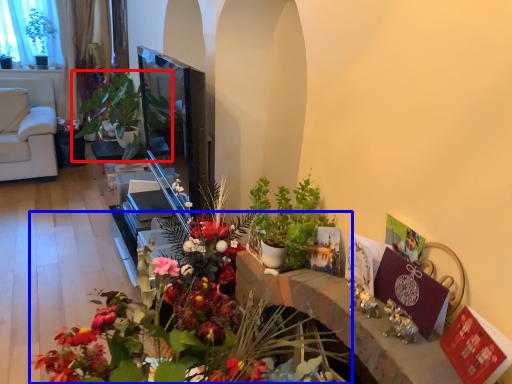
Question: Among these objects, which one is nearest to the camera, houseplant (highlighted by a red box) or flower (highlighted by a blue box)?

Choices:
 (A) houseplant
 (B) flower

Answer: (B)